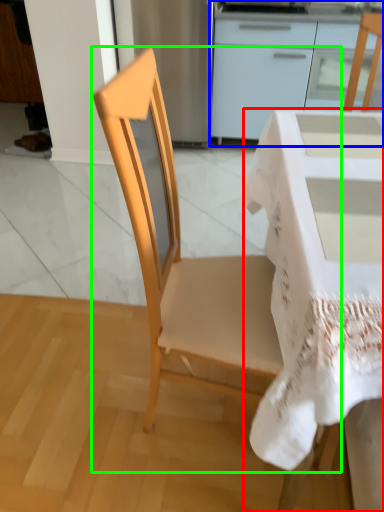
Question: Which object is the farthest from desk (highlighted by a red box)? Choose among these: cabinetry (highlighted by a blue box) or chair (highlighted by a green box).

Choices:
 (A) cabinetry
 (B) chair

Answer: (A)